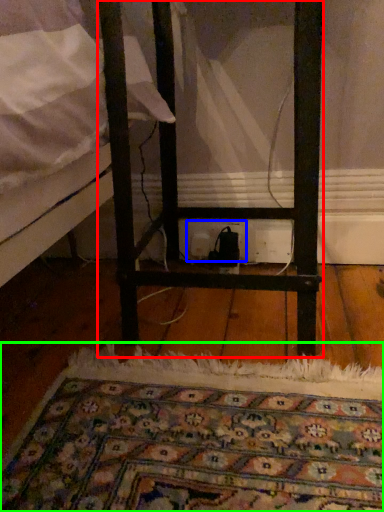
Question: Which object is positioned farthest from furniture (highlighted by a red box)? Select from electric outlet (highlighted by a blue box) and mat (highlighted by a green box).

Choices:
 (A) electric outlet
 (B) mat

Answer: (A)